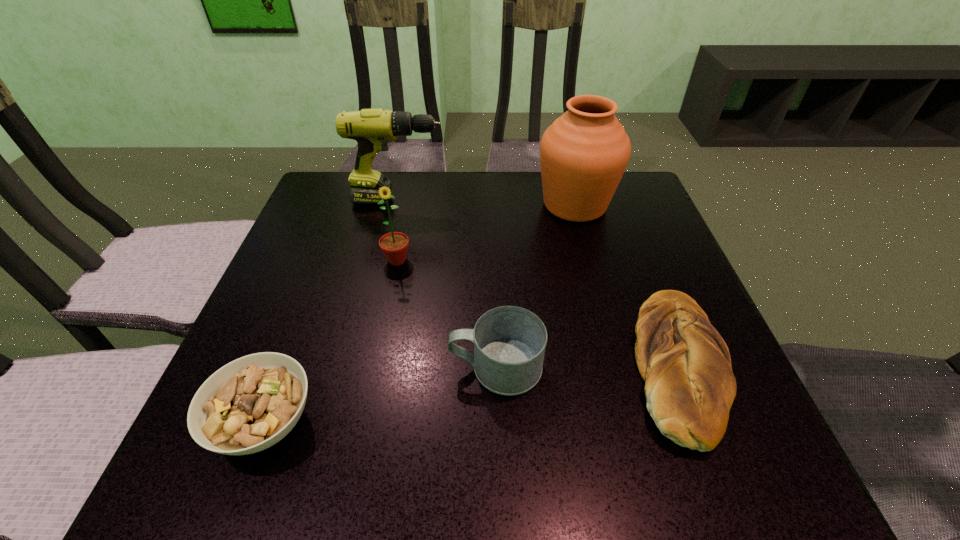
Image resolution: width=960 pixels, height=540 pixels. Find the location of `vacant region at the left edge`. vacant region at the left edge is located at coordinates (314, 284).

You are a GUI agent. You are given a task and a screenshot of the screen. Output one action in this format:
    pyautogui.click(x=<x>, y=<y>)
    Task: Click on the free space at the right edge of the desktop
    The image size is (960, 540).
    Given the screenshot: What is the action you would take?
    pyautogui.click(x=634, y=259)

In the image, there is a desktop. What are the coordinates of `vacant area at the far left corner` in the screenshot? It's located at click(x=335, y=201).

You are a GUI agent. You are given a task and a screenshot of the screen. Output one action in this format:
    pyautogui.click(x=<x>, y=<y>)
    Task: Click on the free region at the near right corner
    The image size is (960, 540).
    Given the screenshot: What is the action you would take?
    pyautogui.click(x=730, y=436)

Locate an element on the screen. The image size is (960, 540). vacant space that's between the third shortest object and the bread is located at coordinates (588, 366).

Locate an element on the screen. free space between the bread and the fourth object from left to right is located at coordinates (588, 366).

Locate an element on the screen. The height and width of the screenshot is (540, 960). unoccupied area between the drill and the stew is located at coordinates (332, 311).

Image resolution: width=960 pixels, height=540 pixels. Identify the location of vacant area between the drill and the third tallest object. (397, 230).

Where is `free point between the urn and the drill`? free point between the urn and the drill is located at coordinates (487, 202).

Locate an element on the screen. This screenshot has width=960, height=540. vacant space that is in between the bread and the stew is located at coordinates (471, 394).